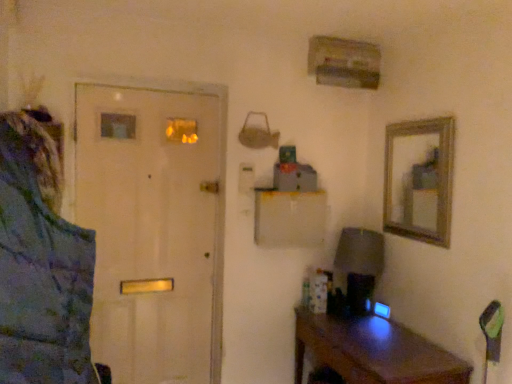
Image resolution: width=512 pixels, height=384 pixels. What are the coordinates of `brown wooden desk at lower right` in the screenshot? It's located at (374, 351).

Identify the location of blue textured jacket at left. Image resolution: width=512 pixels, height=384 pixels. (41, 265).

Identify the location of matte gray lampshade at right. (360, 266).

Locate an element on the screen. Image resolution: width=512 pixels, height=384 pixels. brown wooden desk at lower right is located at coordinates (374, 351).

Can you confirm if white matte door at left is wider than blue textured jacket at left?

No.

Is blue textured jacket at left inside white matte door at left?

No, white matte door at left does not contain blue textured jacket at left.

Where is `door that appears behind the blue textured jacket at left`? This screenshot has height=384, width=512. door that appears behind the blue textured jacket at left is located at coordinates (154, 227).

Is blue textured jacket at left wider or thinner than brown wooden desk at lower right?

Clearly, blue textured jacket at left has less width compared to brown wooden desk at lower right.

Who is bigger, blue textured jacket at left or brown wooden desk at lower right?

brown wooden desk at lower right.

Which is more to the right, blue textured jacket at left or brown wooden desk at lower right?

brown wooden desk at lower right is more to the right.

From the image's perspective, would you say blue textured jacket at left is shown under brown wooden desk at lower right?

Actually, blue textured jacket at left appears above brown wooden desk at lower right in the image.

Is brown wooden desk at lower right not near white matte door at left?

Yes.

Where is `desk that is on the right side of white matte door at left`? This screenshot has width=512, height=384. desk that is on the right side of white matte door at left is located at coordinates (374, 351).

In terms of width, does brown wooden desk at lower right look wider or thinner when compared to white matte door at left?

brown wooden desk at lower right is wider than white matte door at left.

Based on the photo, is brown wooden desk at lower right bigger or smaller than white matte door at left?

Considering their sizes, brown wooden desk at lower right takes up more space than white matte door at left.

You are a GUI agent. You are given a task and a screenshot of the screen. Output one action in this format:
    pyautogui.click(x=<x>, y=<y>)
    Task: Click on the desk located on the right of blue textured jacket at left
    
    Given the screenshot: What is the action you would take?
    coord(374,351)

Which of these two, brown wooden desk at lower right or blue textured jacket at left, is wider?

brown wooden desk at lower right is wider.

Are brown wooden desk at lower right and blue textured jacket at left beside each other?

No, brown wooden desk at lower right is not beside blue textured jacket at left.

Looking at this image, who is smaller, brown wooden desk at lower right or blue textured jacket at left?

Smaller between the two is blue textured jacket at left.

From the image's perspective, would you say matte gray lampshade at right is shown under white matte door at left?

Yes, from the image's perspective, matte gray lampshade at right is below white matte door at left.

Which is correct: matte gray lampshade at right is inside white matte door at left, or outside of it?

matte gray lampshade at right is located beyond the bounds of white matte door at left.

Which object is thinner, matte gray lampshade at right or white matte door at left?

white matte door at left is thinner.

This screenshot has height=384, width=512. In order to click on door above the matte gray lampshade at right (from the image's perspective) in this screenshot , I will do `click(154, 227)`.

I want to click on door lying behind the brown wooden desk at lower right, so click(x=154, y=227).

Is white matte door at left placed right next to brown wooden desk at lower right?

white matte door at left and brown wooden desk at lower right are clearly separated.

Based on the photo, which of these two, white matte door at left or brown wooden desk at lower right, stands shorter?

brown wooden desk at lower right.

Is blue textured jacket at left looking in the opposite direction of white matte door at left?

No, blue textured jacket at left's orientation is not away from white matte door at left.

Does blue textured jacket at left have a lesser width compared to white matte door at left?

No.

Is blue textured jacket at left directly adjacent to white matte door at left?

blue textured jacket at left and white matte door at left are not in contact.

Identify the location of door located on the left of blue textured jacket at left. (154, 227).

I want to click on desk located on the right of blue textured jacket at left, so click(374, 351).

Looking at this image, which object lies further to the anchor point white matte door at left, brown wooden desk at lower right or matte gray lampshade at right?

matte gray lampshade at right is positioned further to the anchor white matte door at left.

From the image, which object appears to be farther from blue textured jacket at left, brown wooden desk at lower right or white matte door at left?

white matte door at left is further to blue textured jacket at left.

In the scene shown: Looking at the image, which one is located further to brown wooden desk at lower right, matte gray lampshade at right or white matte door at left?

white matte door at left lies further to brown wooden desk at lower right than the other object.

Estimate the real-world distances between objects in this image. Which object is further from matte gray lampshade at right, white matte door at left or brown wooden desk at lower right?

Among the two, white matte door at left is located further to matte gray lampshade at right.

Looking at the image, which one is located further to white matte door at left, brown wooden desk at lower right or blue textured jacket at left?

blue textured jacket at left is further to white matte door at left.

Which object lies further to the anchor point white matte door at left, matte gray lampshade at right or blue textured jacket at left?

blue textured jacket at left.

Considering their positions, is brown wooden desk at lower right positioned closer to matte gray lampshade at right than white matte door at left?

brown wooden desk at lower right is positioned closer to the anchor matte gray lampshade at right.

Estimate the real-world distances between objects in this image. Which object is further from blue textured jacket at left, brown wooden desk at lower right or matte gray lampshade at right?

matte gray lampshade at right.

Find the location of a particular element. desk positioned between blue textured jacket at left and white matte door at left from near to far is located at coordinates (374, 351).

Locate an element on the screen. table lamp between white matte door at left and brown wooden desk at lower right in the horizontal direction is located at coordinates (360, 266).

The image size is (512, 384). I want to click on door between blue textured jacket at left and matte gray lampshade at right along the z-axis, so click(154, 227).

Find the location of a particular element. The image size is (512, 384). desk between blue textured jacket at left and matte gray lampshade at right from front to back is located at coordinates (374, 351).